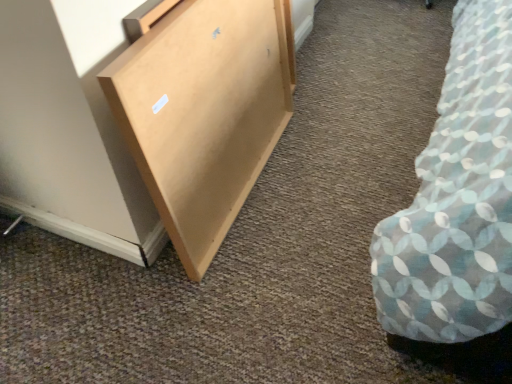
The width and height of the screenshot is (512, 384). What are the coordinates of `natural wood board at left` in the screenshot? It's located at (204, 112).

What do you see at coordinates (204, 112) in the screenshot? The width and height of the screenshot is (512, 384). I see `natural wood board at left` at bounding box center [204, 112].

Locate an element on the screen. The width and height of the screenshot is (512, 384). natural wood board at left is located at coordinates (204, 112).